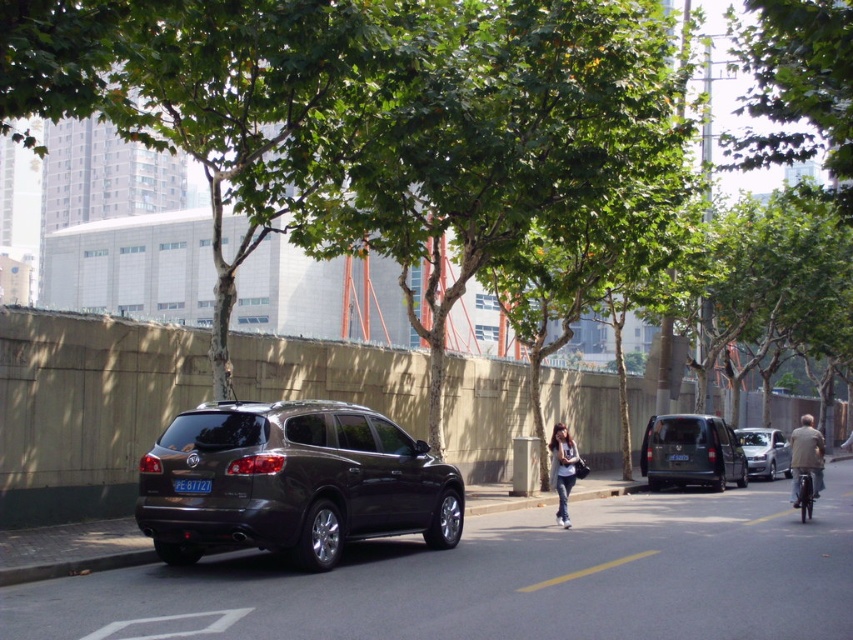
Between satin dark gray minivan at center and metallic silver bicycle at right, which one appears on the right side from the viewer's perspective?

metallic silver bicycle at right

Is point (155, 454) positioned behind point (809, 486)?

No, it is not.

Where is `satin dark gray minivan at center`? satin dark gray minivan at center is located at coordinates (292, 483).

Between dark gray matte minivan at center and matte gray van at right, which one is positioned lower?

matte gray van at right

Does dark gray matte minivan at center have a greater width compared to matte gray van at right?

Indeed, dark gray matte minivan at center has a greater width compared to matte gray van at right.

Locate an element on the screen. Image resolution: width=853 pixels, height=640 pixels. dark gray matte minivan at center is located at coordinates (691, 452).

Is dark gray matte minivan at center shorter than metallic silver bicycle at right?

No, dark gray matte minivan at center is not shorter than metallic silver bicycle at right.

Measure the distance between point (645, 474) and camera.

A distance of 69.68 feet exists between point (645, 474) and camera.

Between point (663, 420) and point (811, 502), which one is positioned in front?

Point (811, 502) is more forward.

At what (x,y) coordinates should I click in order to perform the action: click on dark gray matte minivan at center. Please return your answer as a coordinate pair (x, y). The image size is (853, 640). Looking at the image, I should click on (691, 452).